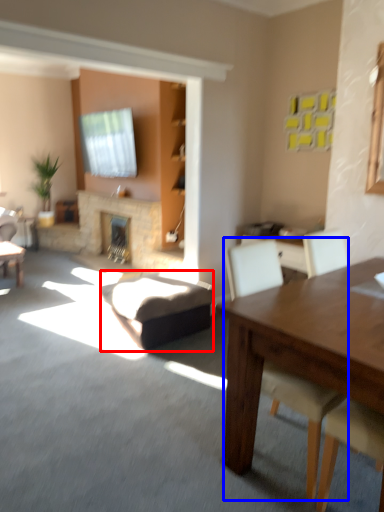
Question: Which object is further to the camera taking this photo, swivel chair (highlighted by a red box) or chair (highlighted by a blue box)?

Choices:
 (A) swivel chair
 (B) chair

Answer: (A)